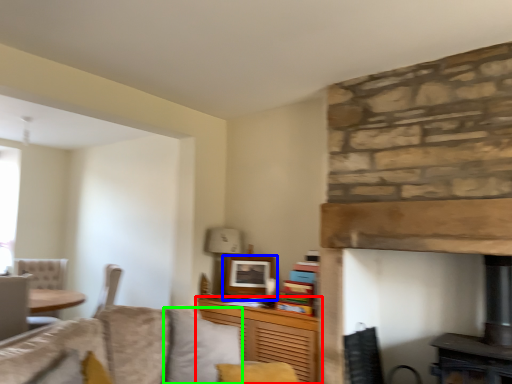
Question: Considering the real-world distances, which object is farthest from cabinetry (highlighted by a red box)? picture frame (highlighted by a blue box) or pillow (highlighted by a green box)?

Choices:
 (A) picture frame
 (B) pillow

Answer: (B)